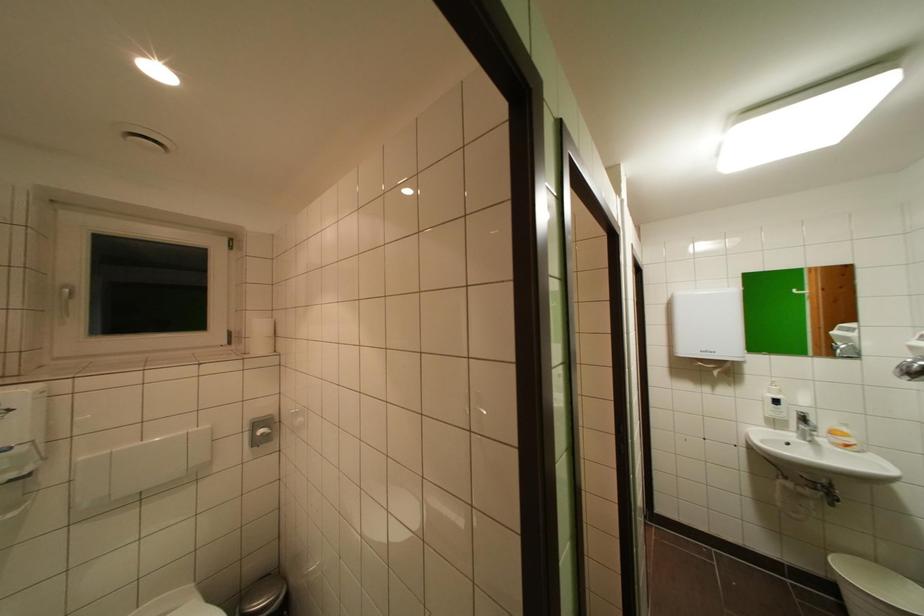
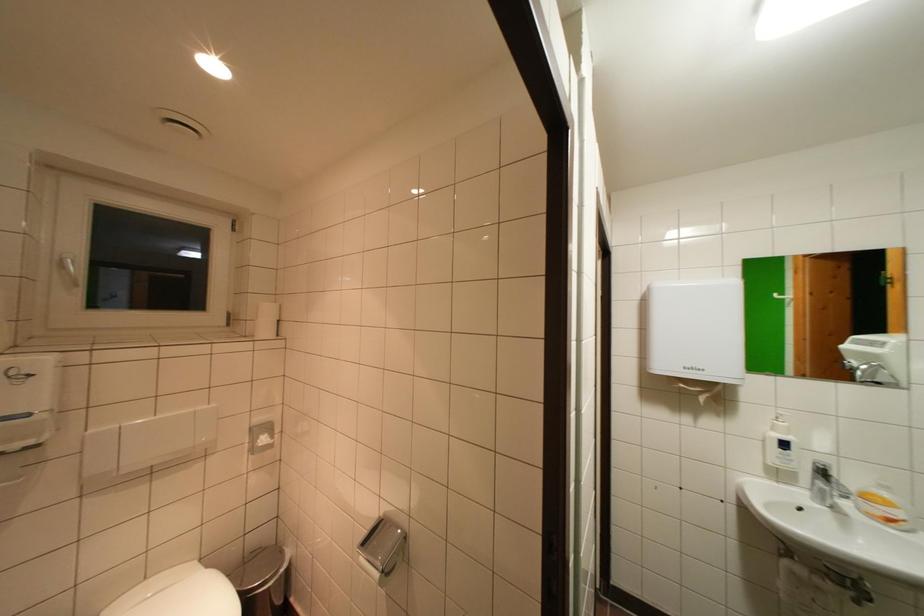
Looking at this image, what movement of the cameraman would produce the second image?

The cameraman walked toward right, forward.